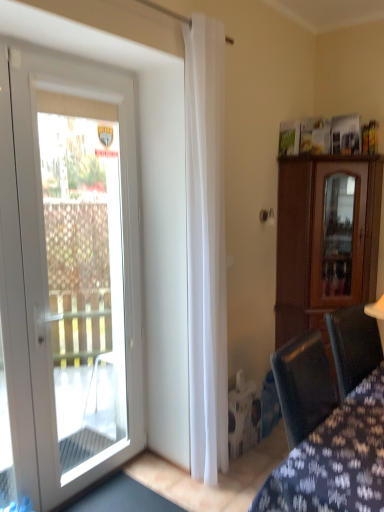
Question: Considering the relative sizes of white sheer curtain at center and white glass door at left in the image provided, is white sheer curtain at center thinner than white glass door at left?

Choices:
 (A) no
 (B) yes

Answer: (B)

Question: Is white sheer curtain at center shorter than white glass door at left?

Choices:
 (A) yes
 (B) no

Answer: (B)

Question: From the image's perspective, is white sheer curtain at center over white glass door at left?

Choices:
 (A) no
 (B) yes

Answer: (B)

Question: From a real-world perspective, is white sheer curtain at center positioned over white glass door at left based on gravity?

Choices:
 (A) yes
 (B) no

Answer: (A)

Question: Is white sheer curtain at center facing away from white glass door at left?

Choices:
 (A) no
 (B) yes

Answer: (A)

Question: Is brown wooden cabinet at right taller or shorter than white glass door at left?

Choices:
 (A) tall
 (B) short

Answer: (B)

Question: Is point (306, 225) positioned closer to the camera than point (127, 269)?

Choices:
 (A) closer
 (B) farther

Answer: (B)

Question: In the image, is brown wooden cabinet at right on the left side or the right side of white glass door at left?

Choices:
 (A) left
 (B) right

Answer: (B)

Question: Would you say brown wooden cabinet at right is inside or outside white glass door at left?

Choices:
 (A) outside
 (B) inside

Answer: (A)

Question: Does point (29, 118) appear closer or farther from the camera than point (304, 316)?

Choices:
 (A) farther
 (B) closer

Answer: (B)

Question: Would you say white glass door at left is to the left or to the right of brown wooden cabinet at right in the picture?

Choices:
 (A) left
 (B) right

Answer: (A)

Question: From their relative heights in the image, would you say white glass door at left is taller or shorter than brown wooden cabinet at right?

Choices:
 (A) tall
 (B) short

Answer: (A)

Question: Relative to brown wooden cabinet at right, is white glass door at left in front or behind?

Choices:
 (A) behind
 (B) front

Answer: (B)

Question: Is velvet dark blue chair at lower right wider or thinner than white glass door at left?

Choices:
 (A) thin
 (B) wide

Answer: (A)

Question: Is velvet dark blue chair at lower right to the left or to the right of white glass door at left in the image?

Choices:
 (A) right
 (B) left

Answer: (A)